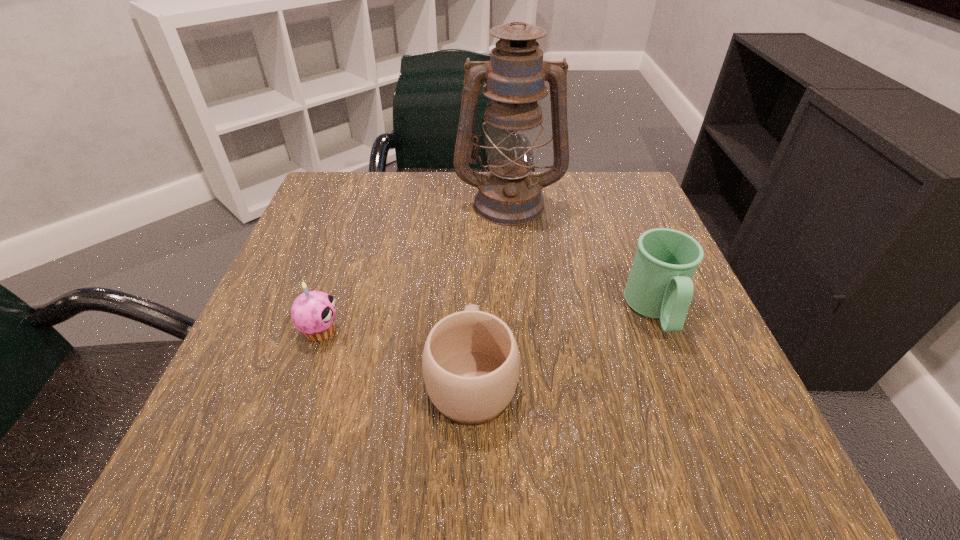
Where is `the closest object to the cupcake`? the closest object to the cupcake is located at coordinates (470, 361).

I want to click on object that is the closest one to the left mug, so click(x=313, y=313).

At what (x,y) coordinates should I click in order to perform the action: click on vacant region that satisfies the following two spatial constraints: 1. on the face of the cupcake; 2. on the side of the left mug with the handle. Please return your answer as a coordinate pair (x, y). The width and height of the screenshot is (960, 540). Looking at the image, I should click on (305, 376).

Identify the location of vacant space that satisfies the following two spatial constraints: 1. on the face of the cupcake; 2. on the side of the shorter mug with the handle. This screenshot has width=960, height=540. (305, 376).

Image resolution: width=960 pixels, height=540 pixels. In order to click on vacant position in the image that satisfies the following two spatial constraints: 1. on the side of the shorter mug with the handle; 2. on the face of the leftmost object in this screenshot , I will do `click(472, 331)`.

This screenshot has height=540, width=960. I want to click on free space that satisfies the following two spatial constraints: 1. on the side of the right mug with the handle; 2. on the face of the cupcake, so click(x=663, y=331).

Image resolution: width=960 pixels, height=540 pixels. Identify the location of vacant space that satisfies the following two spatial constraints: 1. on the side of the rightmost object with the handle; 2. on the face of the cupcake. (663, 331).

You are a GUI agent. You are given a task and a screenshot of the screen. Output one action in this format:
    pyautogui.click(x=<x>, y=<y>)
    Task: Click on the free space that satisfies the following two spatial constraints: 1. on the side of the right mug with the handle; 2. on the face of the cupcake
    The width and height of the screenshot is (960, 540).
    Given the screenshot: What is the action you would take?
    pyautogui.click(x=663, y=331)